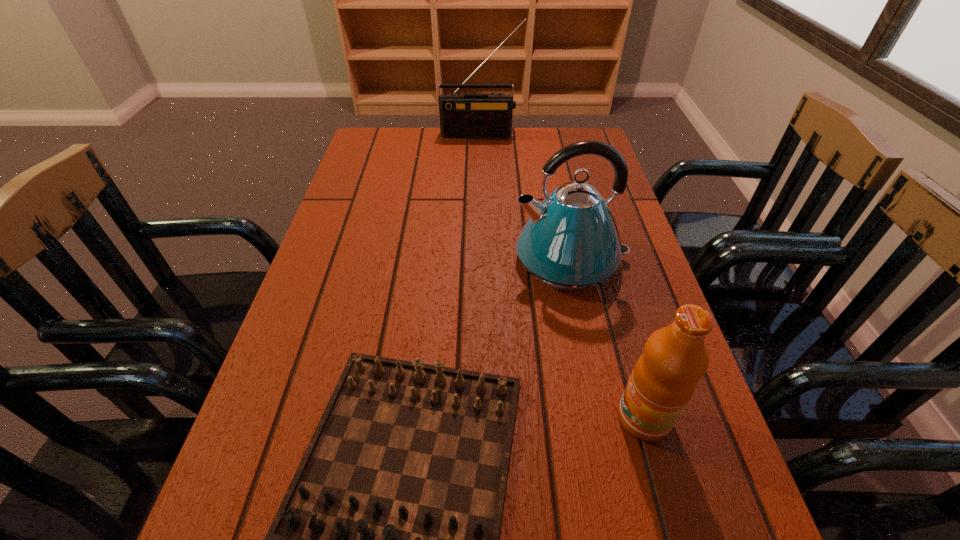
This screenshot has height=540, width=960. I want to click on radio receiver, so click(x=461, y=115).

Where is `the third nearest object`? The width and height of the screenshot is (960, 540). the third nearest object is located at coordinates (571, 242).

Where is `fruit juice`? fruit juice is located at coordinates (664, 379).

Identify the location of free space located 0.110m on the front-facing side of the radio receiver. (480, 156).

Locate an element on the screen. The height and width of the screenshot is (540, 960). free point located at the spout of the third nearest object is located at coordinates (444, 259).

Identify the location of free spot located 0.360m at the spout of the third nearest object. (358, 259).

Find the location of a particular element. vacant space located 0.210m at the spout of the third nearest object is located at coordinates (422, 259).

At what (x,y) coordinates should I click in order to perform the action: click on free region located on the label side of the fruit juice. Please return your answer as a coordinate pair (x, y). Image resolution: width=960 pixels, height=540 pixels. Looking at the image, I should click on (457, 417).

Where is `vacant space located 0.330m on the label side of the fruit juice`? vacant space located 0.330m on the label side of the fruit juice is located at coordinates (421, 417).

Locate an element on the screen. vacant region located on the label side of the fruit juice is located at coordinates (492, 417).